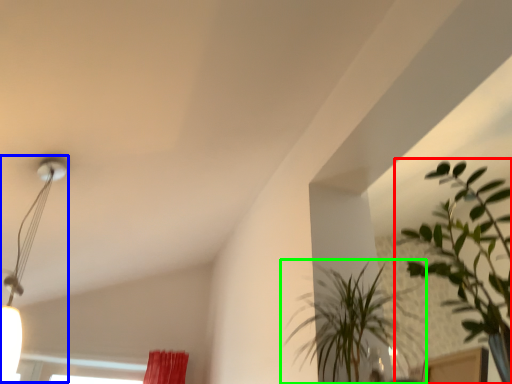
Question: Based on their relative distances, which object is nearer to houseplant (highlighted by a red box)? Choose from lamp (highlighted by a blue box) and houseplant (highlighted by a green box).

Choices:
 (A) lamp
 (B) houseplant

Answer: (B)